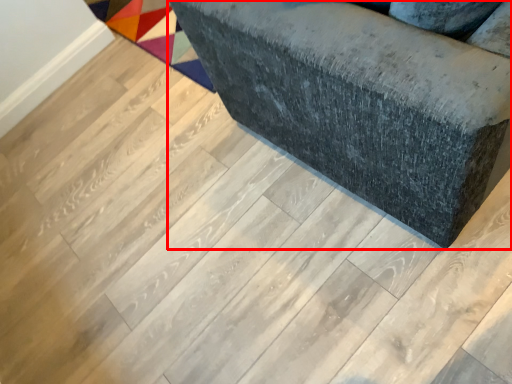
Question: From the image's perspective, what is the correct spatial positioning of furniture (annotated by the red box) in reference to mat?

Choices:
 (A) below
 (B) above

Answer: (A)